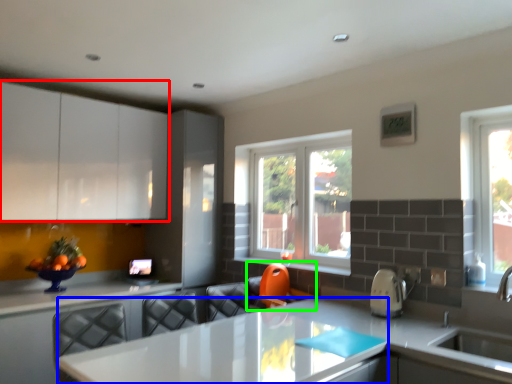
Question: Estimate the real-world distances between objects in this image. Which object is closer to cabinetry (highlighted by a red box), table (highlighted by a blue box) or swivel chair (highlighted by a green box)?

Choices:
 (A) table
 (B) swivel chair

Answer: (B)